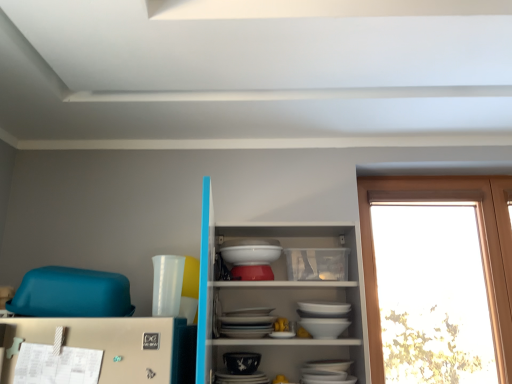
Image resolution: width=512 pixels, height=384 pixels. Describe the element at coordinates (480, 244) in the screenshot. I see `transparent glass window at right` at that location.

What do you see at coordinates (250, 253) in the screenshot? I see `white glossy bowl at center` at bounding box center [250, 253].

The width and height of the screenshot is (512, 384). Identify the location of transparent glass window at right. (480, 244).

Looking at this image, between white glossy bowls at center and transparent glass window at right, which one is positioned in front?

white glossy bowls at center.

Does white glossy bowls at center have a larger size compared to transparent glass window at right?

Yes.

From the picture: Is porcelain bowl at center not close to white glossy bowl at center?

No, there isn't a large distance between porcelain bowl at center and white glossy bowl at center.

From a real-world perspective, is porcelain bowl at center under white glossy bowl at center?

Yes, from a real-world perspective, porcelain bowl at center is below white glossy bowl at center.

Looking at their sizes, would you say porcelain bowl at center is wider or thinner than white glossy bowl at center?

In the image, porcelain bowl at center appears to be more narrow than white glossy bowl at center.

Looking at this image, can you confirm if porcelain bowl at center is positioned to the left of white glossy bowl at center?

Yes.

Is transparent glass window at right aimed at white glossy bowl at center?

No, transparent glass window at right is not facing towards white glossy bowl at center.

Is transparent glass window at right further to camera compared to white glossy bowl at center?

Yes, it is behind white glossy bowl at center.

From a real-world perspective, is transparent glass window at right located beneath white glossy bowl at center?

Yes.

Considering their positions, is transparent glass window at right located in front of or behind white glossy bowls at center?

transparent glass window at right is positioned farther from the viewer than white glossy bowls at center.

Is white glossy bowls at center a part of transparent glass window at right?

Actually, white glossy bowls at center is outside transparent glass window at right.

What's the angular difference between transparent glass window at right and white glossy bowls at center's facing directions?

The angle between the facing direction of transparent glass window at right and the facing direction of white glossy bowls at center is 0.835 degrees.

Is white glossy bowls at center at the back of transparent glass window at right?

No, white glossy bowls at center is not at the back of transparent glass window at right.

Does point (266, 251) lie behind point (233, 361)?

That is True.

Considering the sizes of objects white glossy bowl at center and porcelain bowl at center in the image provided, who is bigger, white glossy bowl at center or porcelain bowl at center?

white glossy bowl at center is bigger.

From the image's perspective, between white glossy bowl at center and porcelain bowl at center, who is located below?

porcelain bowl at center.

Between white glossy bowl at center and porcelain bowl at center, which one has smaller width?

porcelain bowl at center is thinner.

From a real-world perspective, is porcelain bowl at center on white glossy bowls at center?

Incorrect, from a real-world perspective, porcelain bowl at center is lower than white glossy bowls at center.

Is porcelain bowl at center oriented towards white glossy bowls at center?

Yes, porcelain bowl at center is aimed at white glossy bowls at center.

Is porcelain bowl at center next to white glossy bowls at center and touching it?

No, porcelain bowl at center is not next to white glossy bowls at center.

Looking at their sizes, would you say transparent glass window at right is wider or thinner than porcelain bowl at center?

Clearly, transparent glass window at right has less width compared to porcelain bowl at center.

Consider the image. From the image's perspective, does transparent glass window at right appear lower than porcelain bowl at center?

No, from the image's perspective, transparent glass window at right is not beneath porcelain bowl at center.

Is transparent glass window at right not inside porcelain bowl at center?

Yes, transparent glass window at right is outside of porcelain bowl at center.

Which object is closer to the camera, transparent glass window at right or porcelain bowl at center?

porcelain bowl at center is in front.

The image size is (512, 384). I want to click on shelf above the transparent glass window at right (from the image's perspective), so click(x=277, y=298).

You are a GUI agent. You are given a task and a screenshot of the screen. Output one action in this format:
    pyautogui.click(x=<x>, y=<y>)
    Task: Click on the tableware in front of the white glossy bowl at center
    This screenshot has width=512, height=384.
    Given the screenshot: What is the action you would take?
    pyautogui.click(x=241, y=362)

Which object lies nearer to the anchor point white glossy bowls at center, transparent glass window at right or white glossy bowl at center?

white glossy bowl at center is positioned closer to the anchor white glossy bowls at center.

Looking at the image, which one is located further to transparent glass window at right, porcelain bowl at center or white glossy bowls at center?

porcelain bowl at center lies further to transparent glass window at right than the other object.

Looking at this image, which object lies further to the anchor point white glossy bowl at center, porcelain bowl at center or white glossy bowls at center?

Among the two, porcelain bowl at center is located further to white glossy bowl at center.

Estimate the real-world distances between objects in this image. Which object is further from white glossy bowl at center, white glossy bowls at center or transparent glass window at right?

The object further to white glossy bowl at center is transparent glass window at right.

Based on their spatial positions, is transparent glass window at right or porcelain bowl at center closer to white glossy bowl at center?

porcelain bowl at center lies closer to white glossy bowl at center than the other object.

When comparing their distances from white glossy bowls at center, does porcelain bowl at center or transparent glass window at right seem closer?

Among the two, porcelain bowl at center is located nearer to white glossy bowls at center.

Looking at the image, which one is located further to white glossy bowl at center, porcelain bowl at center or transparent glass window at right?

transparent glass window at right is further to white glossy bowl at center.

Looking at this image, from the image, which object appears to be farther from white glossy bowl at center, transparent glass window at right or white glossy bowls at center?

transparent glass window at right.

Locate an element on the screen. The width and height of the screenshot is (512, 384). shelf between porcelain bowl at center and transparent glass window at right in the horizontal direction is located at coordinates click(277, 298).

Where is `table situated between porcelain bowl at center and transparent glass window at right from left to right`? Image resolution: width=512 pixels, height=384 pixels. table situated between porcelain bowl at center and transparent glass window at right from left to right is located at coordinates (250, 253).

Where is `tableware between white glossy bowls at center and white glossy bowl at center along the z-axis`? tableware between white glossy bowls at center and white glossy bowl at center along the z-axis is located at coordinates (241, 362).

This screenshot has width=512, height=384. What are the coordinates of `shelf located between white glossy bowl at center and transparent glass window at right in the left-right direction` in the screenshot? It's located at (277, 298).